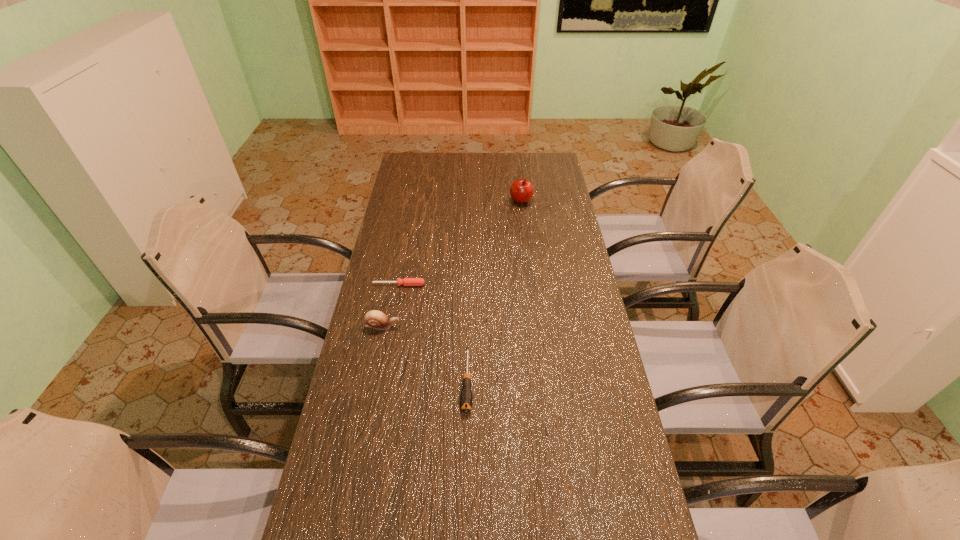
You are a GUI agent. You are given a task and a screenshot of the screen. Output one action in this format:
    pyautogui.click(x=<x>, y=<y>)
    Task: Click on the apple
    
    Given the screenshot: What is the action you would take?
    pyautogui.click(x=521, y=191)

In order to click on the farthest object in this screenshot , I will do `click(521, 191)`.

I want to click on the second nearest object, so click(x=375, y=319).

This screenshot has height=540, width=960. Find the location of `escargot`. escargot is located at coordinates (375, 319).

You are a GUI agent. You are given a task and a screenshot of the screen. Output one action in this format:
    pyautogui.click(x=<x>, y=<y>)
    Task: Click on the nearer screwdriver
    The height and width of the screenshot is (540, 960).
    Given the screenshot: What is the action you would take?
    pyautogui.click(x=466, y=398)

You are a GUI agent. You are given a task and a screenshot of the screen. Output one action in this format:
    pyautogui.click(x=<x>, y=<y>)
    Task: Click on the taller screwdriver
    
    Given the screenshot: What is the action you would take?
    pyautogui.click(x=466, y=398)

Where is `the farther screwdriver`? the farther screwdriver is located at coordinates (406, 281).

Where is `the second farthest object`? The width and height of the screenshot is (960, 540). the second farthest object is located at coordinates (406, 281).

Image resolution: width=960 pixels, height=540 pixels. Identify the location of free space located on the back of the tallest object. (519, 187).

At what (x,y) coordinates should I click in order to perform the action: click on free point located on the front-facing side of the second tallest object. Please return your answer as a coordinate pair (x, y). The image size is (960, 540). Looking at the image, I should click on (441, 326).